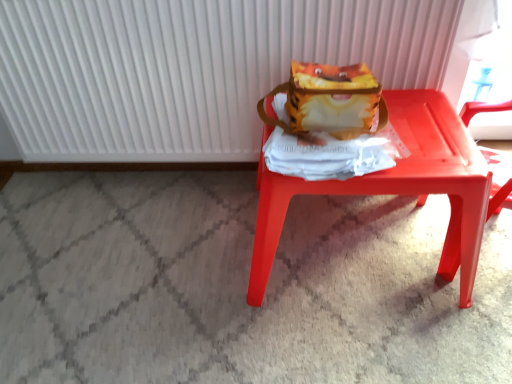
Question: Considering the relative positions of white ribbed radiator at upper center and matte plastic stool at center in the image provided, is white ribbed radiator at upper center to the right of matte plastic stool at center from the viewer's perspective?

Choices:
 (A) yes
 (B) no

Answer: (B)

Question: Is white ribbed radiator at upper center next to matte plastic stool at center?

Choices:
 (A) yes
 (B) no

Answer: (B)

Question: Is white ribbed radiator at upper center not inside matte plastic stool at center?

Choices:
 (A) yes
 (B) no

Answer: (A)

Question: Considering the relative sizes of white ribbed radiator at upper center and matte plastic stool at center in the image provided, is white ribbed radiator at upper center taller than matte plastic stool at center?

Choices:
 (A) no
 (B) yes

Answer: (B)

Question: Considering the relative sizes of white ribbed radiator at upper center and matte plastic stool at center in the image provided, is white ribbed radiator at upper center thinner than matte plastic stool at center?

Choices:
 (A) no
 (B) yes

Answer: (B)

Question: Does point (225, 125) appear closer or farther from the camera than point (358, 114)?

Choices:
 (A) farther
 (B) closer

Answer: (A)

Question: Based on their positions, is white ribbed radiator at upper center located to the left or right of matte yellow fabric shoulder bag at center?

Choices:
 (A) left
 (B) right

Answer: (A)

Question: From a real-world perspective, is white ribbed radiator at upper center above or below matte yellow fabric shoulder bag at center?

Choices:
 (A) above
 (B) below

Answer: (B)

Question: Is white ribbed radiator at upper center inside the boundaries of matte yellow fabric shoulder bag at center, or outside?

Choices:
 (A) inside
 (B) outside

Answer: (B)

Question: Would you say matte yellow fabric shoulder bag at center is to the left or to the right of matte plastic stool at center in the picture?

Choices:
 (A) right
 (B) left

Answer: (B)

Question: Is matte yellow fabric shoulder bag at center wider or thinner than matte plastic stool at center?

Choices:
 (A) wide
 (B) thin

Answer: (B)

Question: Is matte yellow fabric shoulder bag at center spatially inside matte plastic stool at center, or outside of it?

Choices:
 (A) inside
 (B) outside

Answer: (B)

Question: Is matte yellow fabric shoulder bag at center bigger or smaller than matte plastic stool at center?

Choices:
 (A) big
 (B) small

Answer: (B)

Question: Is point (471, 289) closer or farther from the camera than point (332, 135)?

Choices:
 (A) closer
 (B) farther

Answer: (B)

Question: From a real-world perspective, is matte plastic stool at center positioned above or below matte yellow fabric shoulder bag at center?

Choices:
 (A) below
 (B) above

Answer: (A)